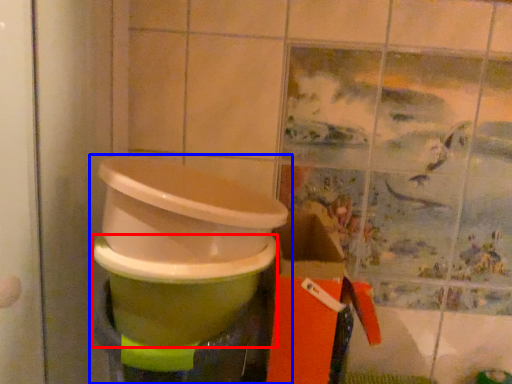
Question: Which object appears farthest to the camera in this image, toilet bowl (highlighted by a red box) or waste container (highlighted by a blue box)?

Choices:
 (A) toilet bowl
 (B) waste container

Answer: (A)